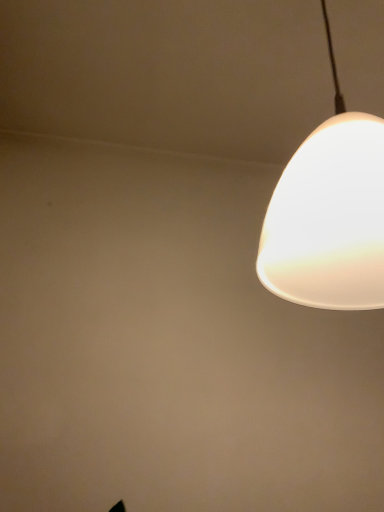
Measure the distance between white matte lampshade at upper right and camera.

A distance of 15.43 inches exists between white matte lampshade at upper right and camera.

The image size is (384, 512). What do you see at coordinates (329, 214) in the screenshot? I see `white matte lampshade at upper right` at bounding box center [329, 214].

Identify the location of white matte lampshade at upper right. (329, 214).

You are a GUI agent. You are given a task and a screenshot of the screen. Output one action in this format:
    pyautogui.click(x=<x>, y=<y>)
    Task: Click on the white matte lampshade at upper right
    
    Given the screenshot: What is the action you would take?
    pyautogui.click(x=329, y=214)